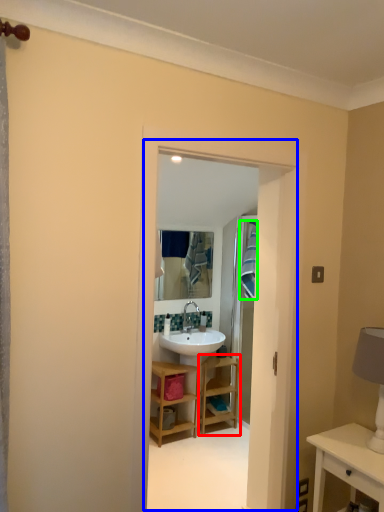
Question: Which object is the closest to the shelf (highlighted by a red box)? Choose among these: residence (highlighted by a blue box) or laundry (highlighted by a green box).

Choices:
 (A) residence
 (B) laundry

Answer: (B)